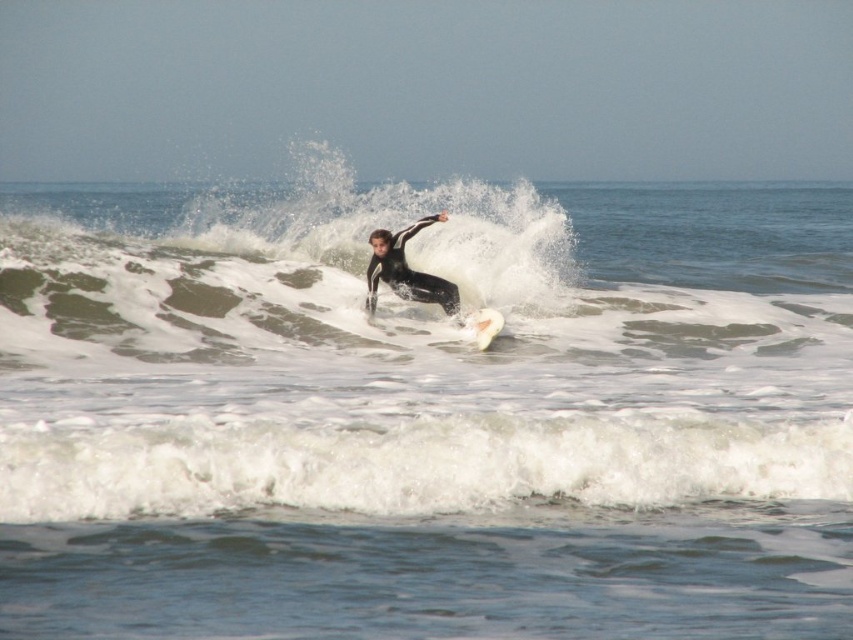
Between white foamy water at center and white foamy wave at lower center, which one appears on the right side from the viewer's perspective?

Positioned to the right is white foamy wave at lower center.

Looking at this image, does white foamy water at center come behind white foamy wave at lower center?

No, it is not.

Is point (836, 451) positioned before point (375, 500)?

No, (836, 451) is further to viewer.

At what (x,y) coordinates should I click in order to perform the action: click on white foamy water at center. Please return your answer as a coordinate pair (x, y). Looking at the image, I should click on (426, 416).

Between white foamy wave at lower center and black matte wetsuit at center, which one has less height?

With less height is white foamy wave at lower center.

Can you confirm if white foamy wave at lower center is bigger than black matte wetsuit at center?

Yes, white foamy wave at lower center is bigger than black matte wetsuit at center.

Does point (456, 452) come farther from viewer compared to point (440, 282)?

No, it is not.

The height and width of the screenshot is (640, 853). Identify the location of white foamy wave at lower center. (415, 465).

Can you confirm if white foamy water at center is taller than black matte wetsuit at center?

Correct, white foamy water at center is much taller as black matte wetsuit at center.

Describe the element at coordinates (426, 416) in the screenshot. The image size is (853, 640). I see `white foamy water at center` at that location.

Find the location of a particular element. The width and height of the screenshot is (853, 640). white foamy water at center is located at coordinates (426, 416).